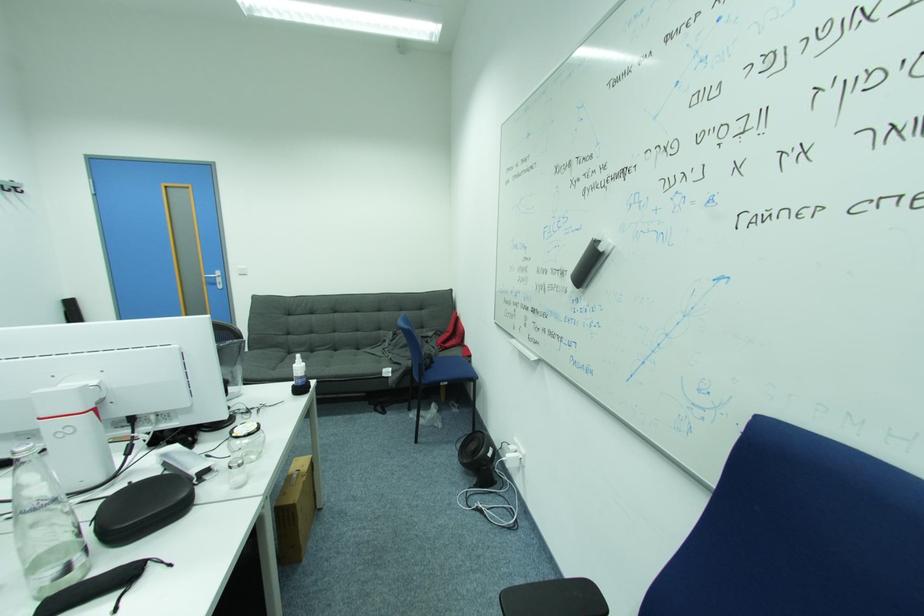
Where would you sit the blue chair sitting surface? Please return your answer as a coordinate pair (x, y).

(448, 370)